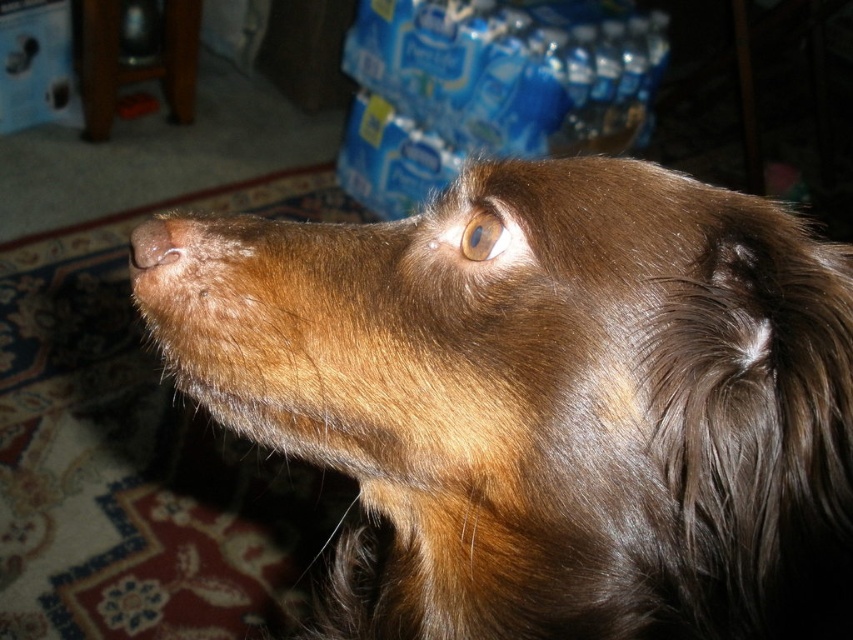
In the scene shown: You are a photographer adjusting your camera settings to focus on two specific points in the image of a dog. The points are labeled as point 1 at coordinates point (x=573, y=340) and point 2 at coordinates point (x=486, y=230). Which point should you focus on first if you want to ensure the dog is sharp in the foreground?

Point (x=573, y=340) is closer to the camera than point (x=486, y=230), so you should focus on point (x=573, y=340) first to ensure the dog in the foreground is sharp.

You are a photographer adjusting your camera to focus on the dog in the image. The camera has a focus point at point (483, 236). What object in the image is at this focus point?

The brown glossy eye at upper center is located at point (483, 236).

You are a photographer trying to focus on the brown glossy eye at upper center and the brown fur at center of a dog. Which object is positioned lower in the image?

The brown glossy eye at upper center is located below the brown fur at center, so the brown glossy eye at upper center is positioned lower in the image.